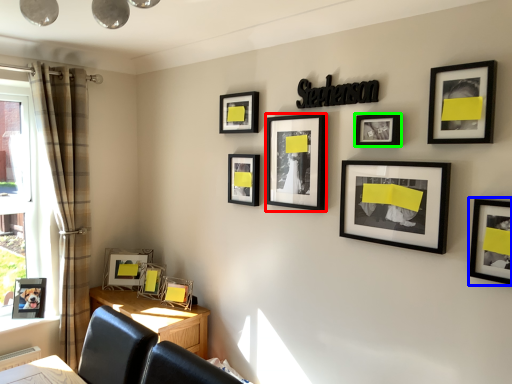
Question: Which object is the farthest from picture frame (highlighted by a red box)? Choose among these: picture frame (highlighted by a blue box) or picture frame (highlighted by a green box).

Choices:
 (A) picture frame
 (B) picture frame

Answer: (A)